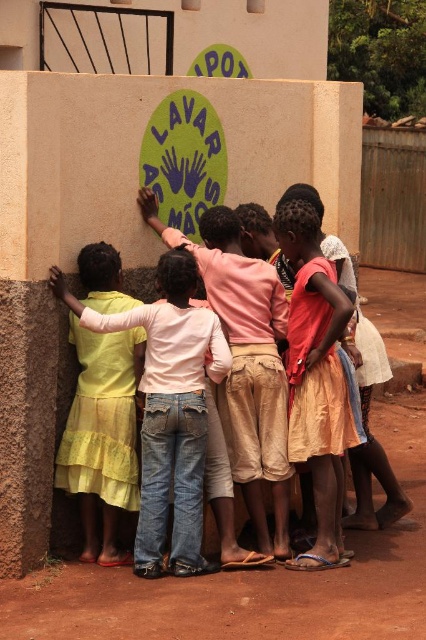
You are a photographer taking a picture of the wall with the sign. You notice a point at coordinates (169, 410) on your camera screen. According to the scene description, what object is located at that point?

The point at coordinates (169, 410) marks light yellow denim jeans at left.

You are a photographer trying to capture a photo of the children in front of the wall sign. You need to ensure both the light yellow denim jeans at left and the pink cotton shirt at center are clearly visible. Which object should you focus on first to ensure proper focus, considering their sizes?

The light yellow denim jeans at left has a smaller size compared to the pink cotton shirt at center. To ensure both are clearly visible, focus on the smaller object first, which is the light yellow denim jeans at left, as it requires more precise focusing due to its smaller size.

You are a photographer trying to capture a photo of the children without any overlapping clothing. Given that the light yellow denim jeans at left might be wider than the light orange skirt at center, which child should you position closer to the camera to ensure their clothing doesn

The light yellow denim jeans at left might be wider than the light orange skirt at center, so positioning the child wearing the light yellow denim jeans at left closer to the camera would help minimize overlap since wider objects appear larger and could block more of the background.